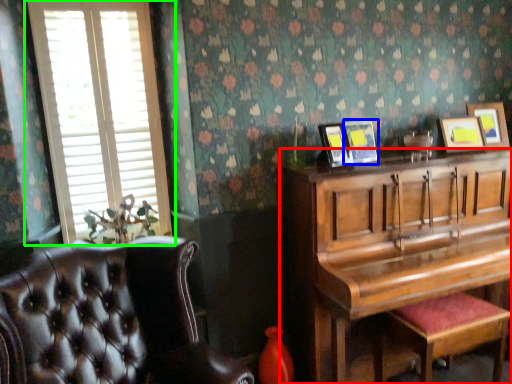
Question: Which object is positioned farthest from piano (highlighted by a red box)? Select from picture frame (highlighted by a blue box) and window (highlighted by a green box).

Choices:
 (A) picture frame
 (B) window

Answer: (B)